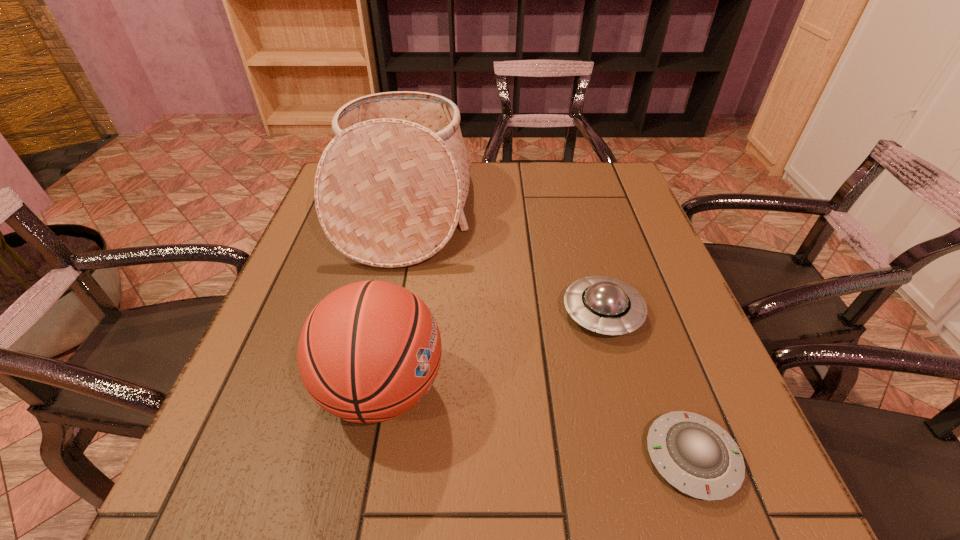
The height and width of the screenshot is (540, 960). Identify the location of vacant space located 0.250m on the back of the shorter saucer. (637, 307).

This screenshot has height=540, width=960. In order to click on object that is at the far edge in this screenshot , I will do `click(390, 188)`.

This screenshot has height=540, width=960. In order to click on object located at the near edge in this screenshot , I will do `click(695, 455)`.

Find the location of a particular element. Image resolution: width=960 pixels, height=540 pixels. basket located at the left edge is located at coordinates (390, 188).

Find the location of a particular element. The width and height of the screenshot is (960, 540). basketball situated at the left edge is located at coordinates (368, 352).

Identify the location of object located at the far left corner. (390, 188).

Identify the location of object located at the near right corner. The image size is (960, 540). (695, 455).

The image size is (960, 540). In the image, there is a desktop. Find the location of `vacant area at the near edge`. vacant area at the near edge is located at coordinates (397, 472).

Where is `vacant space at the left edge`? vacant space at the left edge is located at coordinates (348, 266).

The width and height of the screenshot is (960, 540). I want to click on vacant space at the right edge of the desktop, so [652, 417].